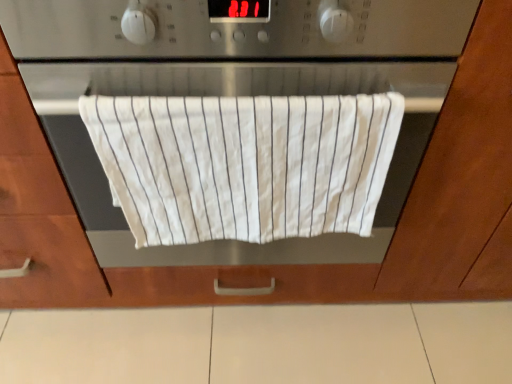
What do you see at coordinates (244, 164) in the screenshot? I see `white striped cloth at center` at bounding box center [244, 164].

Image resolution: width=512 pixels, height=384 pixels. In order to click on white striped cloth at center in this screenshot , I will do `click(244, 164)`.

From the picture: Measure the distance between point (185, 119) and camera.

The depth of point (185, 119) is 57.60 centimeters.

Locate an element on the screen. white striped cloth at center is located at coordinates (244, 164).